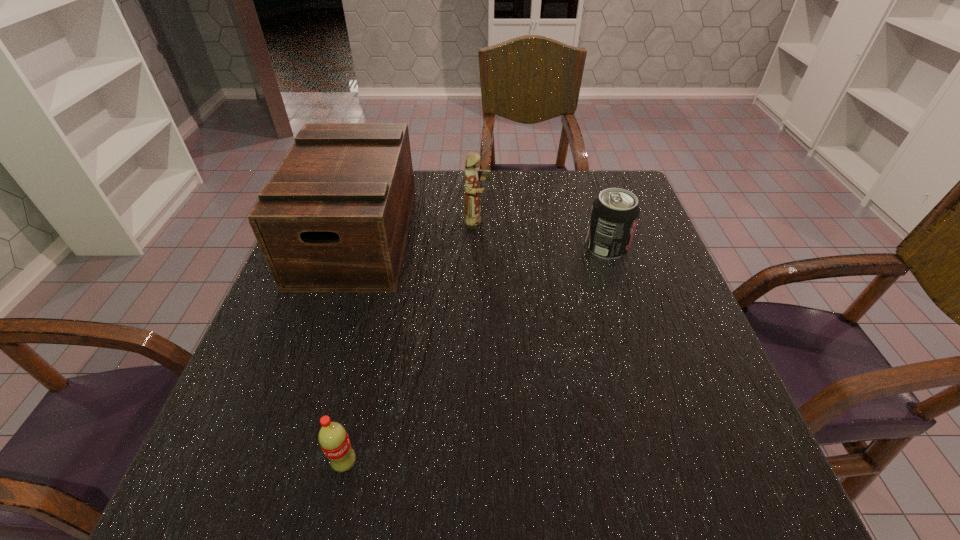
You are a GUI agent. You are given a task and a screenshot of the screen. Output one action in this format:
    pyautogui.click(x=<x>, y=<y>)
    Task: Click on the free space between the figurine and the left soda
    Image resolution: width=960 pixels, height=540 pixels.
    Given the screenshot: What is the action you would take?
    pyautogui.click(x=412, y=343)

You are a GUI agent. You are given a task and a screenshot of the screen. Output one action in this format:
    pyautogui.click(x=<x>, y=<y>)
    Task: Click on the empty space that is in between the rightmost object and the left soda
    
    Given the screenshot: What is the action you would take?
    pyautogui.click(x=475, y=355)

Locate an element on the screen. This screenshot has width=960, height=540. free area in between the nearest object and the box is located at coordinates (350, 349).

Identify the location of vacant region between the nearest object and the box. This screenshot has width=960, height=540. (350, 349).

The height and width of the screenshot is (540, 960). In order to click on vacant region between the nearest object and the box in this screenshot , I will do `click(350, 349)`.

Locate an element on the screen. The width and height of the screenshot is (960, 540). vacant area that lies between the box and the rightmost object is located at coordinates (481, 241).

Locate an element on the screen. vacant region between the left soda and the box is located at coordinates (350, 349).

Where is `free space between the left soda and the right soda`? The image size is (960, 540). free space between the left soda and the right soda is located at coordinates (475, 355).

Find the location of a particular element. This screenshot has height=540, width=960. free space between the rightmost object and the box is located at coordinates (481, 241).

Identify the location of vacant area that lies between the left soda and the box. The width and height of the screenshot is (960, 540). (350, 349).